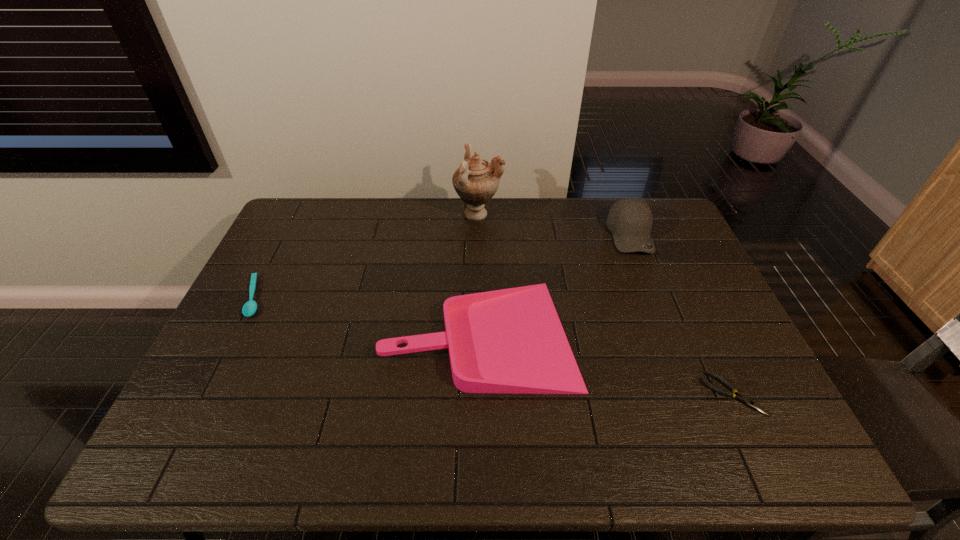
Where is `vacant area at the left edge`? This screenshot has height=540, width=960. vacant area at the left edge is located at coordinates click(234, 384).

Where is `free space at the right edge`? free space at the right edge is located at coordinates (696, 330).

This screenshot has height=540, width=960. What are the coordinates of `vacant space at the near left corner` in the screenshot? It's located at (202, 459).

The image size is (960, 540). Find the location of `vacant space at the far right corner`. vacant space at the far right corner is located at coordinates (685, 235).

Identify the location of vacant space in between the second tallest object and the pliers. This screenshot has height=540, width=960. (682, 314).

At what (x,y) coordinates should I click in order to perform the action: click on unoccupied position between the baseball cap and the spoon. Please return your answer as a coordinate pair (x, y). This screenshot has height=540, width=960. Looking at the image, I should click on (443, 266).

Where is `free spot between the third tallest object and the pliers`? This screenshot has height=540, width=960. free spot between the third tallest object and the pliers is located at coordinates (606, 363).

This screenshot has width=960, height=540. What are the coordinates of `unoccupied position between the fourth shortest object and the third shortest object` in the screenshot? It's located at (556, 284).

Where is `vacant space in between the pliers and the baseball cap`? The width and height of the screenshot is (960, 540). vacant space in between the pliers and the baseball cap is located at coordinates (682, 314).

The height and width of the screenshot is (540, 960). Find the location of `vacant space that's between the dustpan and the baseball cap`. vacant space that's between the dustpan and the baseball cap is located at coordinates (556, 284).